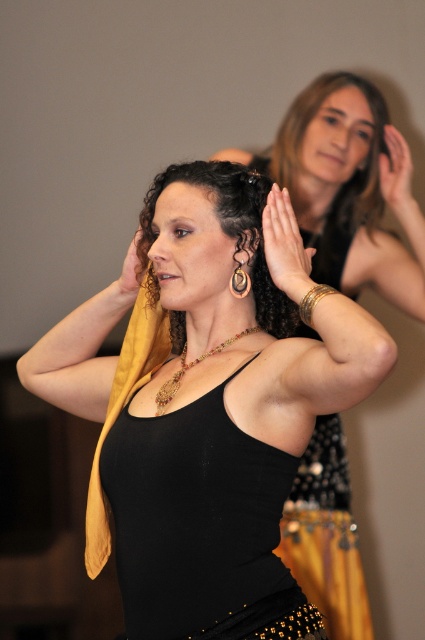
Does smooth brown hair at upper center come behind gold metallic bracelet at upper center?

Yes, it is behind gold metallic bracelet at upper center.

Which is below, smooth brown hair at upper center or gold metallic bracelet at upper center?

gold metallic bracelet at upper center is below.

Between point (331, 81) and point (138, 284), which one is positioned behind?

Point (331, 81)

This screenshot has width=425, height=640. I want to click on smooth brown hair at upper center, so click(311, 120).

Measure the distance between black matte tank top at center and golden metallic bracelet at upper center.

17.62 inches

Between black matte tank top at center and golden metallic bracelet at upper center, which one has less height?

Standing shorter between the two is golden metallic bracelet at upper center.

Between point (175, 456) and point (271, 220), which one is positioned in front?

Point (175, 456)

What are the coordinates of `black matte tank top at center` in the screenshot? It's located at (201, 528).

Is curly brown hair at center wider than gold metallic bracelet at upper center?

Yes.

Which is in front, point (278, 308) or point (139, 278)?

Point (278, 308)

At what (x,y) coordinates should I click in order to perform the action: click on curly brown hair at center. Please return your answer as a coordinate pair (x, y). Image resolution: width=425 pixels, height=640 pixels. Looking at the image, I should click on (235, 228).